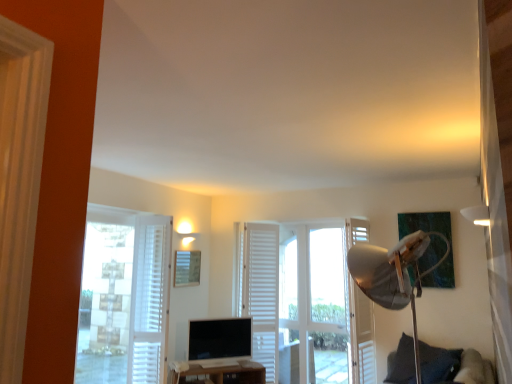
Question: Would you say white textured curtain at left, the second curtain when ordered from right to left, is to the left or to the right of white wooden screen door at right in the picture?

Choices:
 (A) right
 (B) left

Answer: (B)

Question: Considering the positions of white textured curtain at left, which ranks as the 1th curtain in front-to-back order, and white wooden screen door at right in the image, is white textured curtain at left, which ranks as the 1th curtain in front-to-back order, taller or shorter than white wooden screen door at right?

Choices:
 (A) tall
 (B) short

Answer: (B)

Question: Estimate the real-world distances between objects in this image. Which object is closer to the white matte curtain at center, the first curtain positioned from the right?

Choices:
 (A) white wooden screen door at right
 (B) wooden picture frame at center
 (C) white textured curtain at left, the second curtain when ordered from right to left
 (D) white wooden door at center
 (E) matte black computer monitor at center

Answer: (D)

Question: Which object is positioned closest to the wooden picture frame at center?

Choices:
 (A) white textured curtain at left, which ranks as the 1th curtain in front-to-back order
 (B) dark blue fabric pillow at lower right
 (C) white matte lampshade at upper right
 (D) white matte curtain at center, positioned as the first curtain in back-to-front order
 (E) brown wooden tv stand at lower center

Answer: (A)